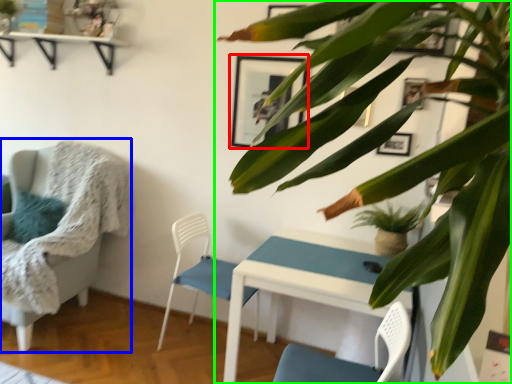
Question: Which is nearer to the picture frame (highlighted by a red box)? chair (highlighted by a blue box) or houseplant (highlighted by a green box).

Choices:
 (A) chair
 (B) houseplant

Answer: (A)